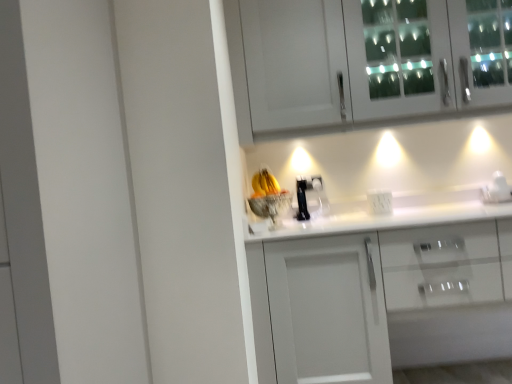
Question: Does white glossy cabinet at center, the second cabinetry viewed from the top, appear on the left side of white plastic electric outlet at center?

Choices:
 (A) yes
 (B) no

Answer: (B)

Question: Is white glossy cabinet at center, the second cabinetry viewed from the top, wider than white plastic electric outlet at center?

Choices:
 (A) yes
 (B) no

Answer: (A)

Question: Considering the relative sizes of white glossy cabinet at center, which is counted as the first cabinetry, starting from the bottom, and white plastic electric outlet at center in the image provided, is white glossy cabinet at center, which is counted as the first cabinetry, starting from the bottom, thinner than white plastic electric outlet at center?

Choices:
 (A) no
 (B) yes

Answer: (A)

Question: Is white glossy cabinet at center, which is counted as the first cabinetry, starting from the bottom, oriented away from white plastic electric outlet at center?

Choices:
 (A) yes
 (B) no

Answer: (B)

Question: Is white glossy cabinet at center, which is counted as the first cabinetry, starting from the bottom, taller than white plastic electric outlet at center?

Choices:
 (A) no
 (B) yes

Answer: (B)

Question: Is white glossy cabinet at center, the second cabinetry viewed from the top, smaller than white plastic electric outlet at center?

Choices:
 (A) yes
 (B) no

Answer: (B)

Question: Does white glossy coffee maker at right have a greater width compared to white glossy cabinet at center, which is counted as the first cabinetry, starting from the bottom?

Choices:
 (A) yes
 (B) no

Answer: (B)

Question: From a real-world perspective, does white glossy coffee maker at right stand above white glossy cabinet at center, the second cabinetry viewed from the top?

Choices:
 (A) yes
 (B) no

Answer: (A)

Question: Is white glossy cabinet at center, the second cabinetry viewed from the top, a part of white glossy coffee maker at right?

Choices:
 (A) no
 (B) yes

Answer: (A)

Question: Can you confirm if white glossy coffee maker at right is thinner than white glossy cabinet at center, the second cabinetry viewed from the top?

Choices:
 (A) no
 (B) yes

Answer: (B)

Question: Does white glossy coffee maker at right have a larger size compared to white glossy cabinet at center, the second cabinetry viewed from the top?

Choices:
 (A) yes
 (B) no

Answer: (B)

Question: Does white glossy coffee maker at right lie behind white glossy cabinet at center, the second cabinetry viewed from the top?

Choices:
 (A) no
 (B) yes

Answer: (B)

Question: Is white glass cabinet at upper center, which is the 2th cabinetry from bottom to top, beside white glossy coffee maker at right?

Choices:
 (A) no
 (B) yes

Answer: (A)